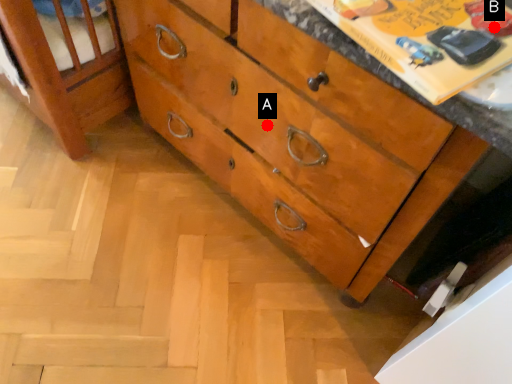
Question: Two points are circled on the image, labeled by A and B beside each circle. Which of the following is the closest to the observer?

Choices:
 (A) A is closer
 (B) B is closer

Answer: (B)